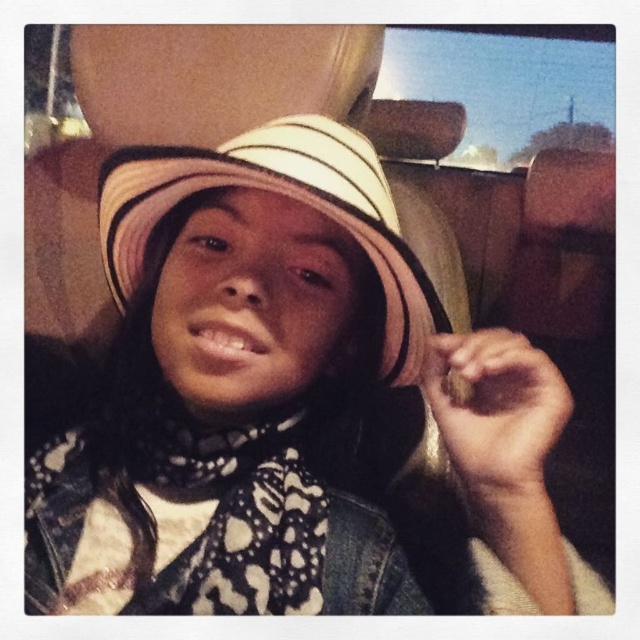
Does point (208, 520) lie in front of point (416, 275)?

No, it is not.

Which is behind, point (316, 387) or point (380, 355)?

Point (316, 387)

This screenshot has height=640, width=640. Find the location of `white striped hat at center`. white striped hat at center is located at coordinates (285, 403).

Between point (346, 600) and point (164, 604), which one is positioned behind?

The point (164, 604) is behind.

Is point (44, 520) farther from camera compared to point (132, 525)?

Yes, it is.

Where is `white striped hat at center`? The width and height of the screenshot is (640, 640). white striped hat at center is located at coordinates (285, 403).

Is black printed scarf at center to the right of white striped fabric hat at center from the viewer's perspective?

Incorrect, black printed scarf at center is not on the right side of white striped fabric hat at center.

In the scene shown: Who is taller, black printed scarf at center or white striped fabric hat at center?

white striped fabric hat at center is taller.

Describe the element at coordinates (214, 508) in the screenshot. I see `black printed scarf at center` at that location.

Where is `black printed scarf at center`? This screenshot has width=640, height=640. black printed scarf at center is located at coordinates (214, 508).